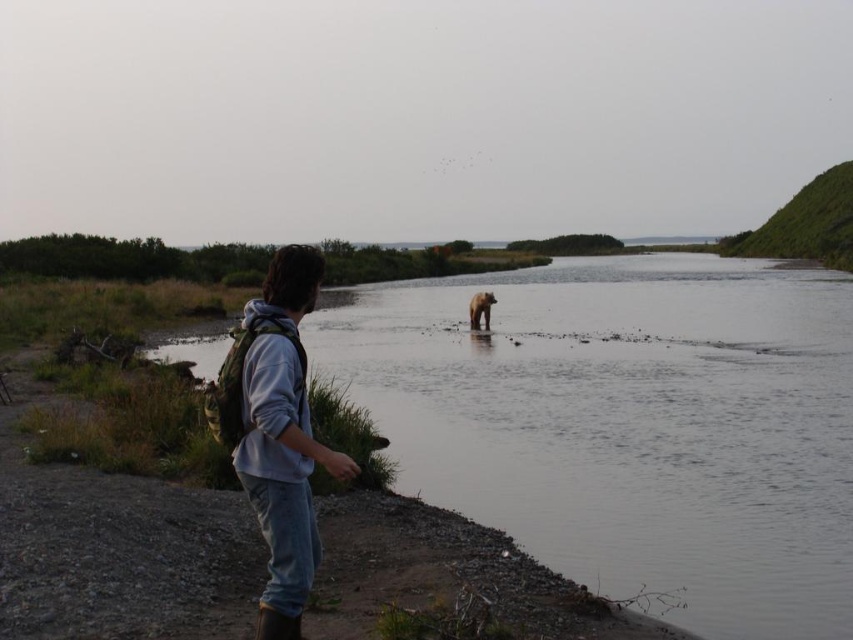
Does brown fur river at center have a greater height compared to denim pants at center?

Yes, brown fur river at center is taller than denim pants at center.

From the picture: Is brown fur river at center thinner than denim pants at center?

No, brown fur river at center is not thinner than denim pants at center.

Find the location of a particular element. Image resolution: width=853 pixels, height=640 pixels. brown fur river at center is located at coordinates (628, 422).

Between point (244, 460) and point (485, 308), which one is positioned in front?

Point (244, 460) is more forward.

You are a GUI agent. You are given a task and a screenshot of the screen. Output one action in this format:
    pyautogui.click(x=<x>, y=<y>)
    Task: Click on the denim pants at center
    
    Given the screenshot: What is the action you would take?
    pyautogui.click(x=276, y=433)

Is brown fur river at center bigger than brown furry bear at center?

Yes.

Can you confirm if brown fur river at center is smaller than brown furry bear at center?

No, brown fur river at center is not smaller than brown furry bear at center.

Image resolution: width=853 pixels, height=640 pixels. In order to click on brown fur river at center in this screenshot , I will do `click(628, 422)`.

I want to click on brown fur river at center, so click(628, 422).